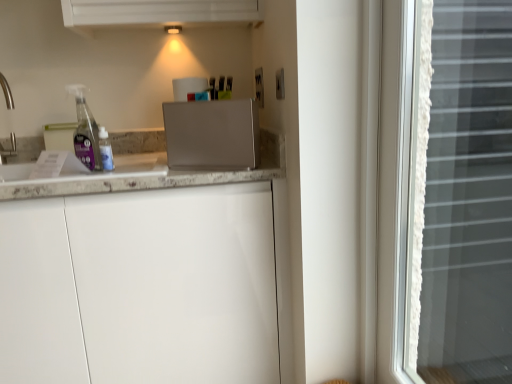
Question: From the image's perspective, is satin silver toaster at center above or below white matte cabinet at center?

Choices:
 (A) below
 (B) above

Answer: (B)

Question: In terms of size, does satin silver toaster at center appear bigger or smaller than white matte cabinet at center?

Choices:
 (A) big
 (B) small

Answer: (B)

Question: Estimate the real-world distances between objects in this image. Which object is closer to the white lace curtain at right?

Choices:
 (A) white matte cabinet at center
 (B) satin silver toaster at center
 (C) white marble countertop at left

Answer: (B)

Question: Estimate the real-world distances between objects in this image. Which object is closer to the white marble countertop at left?

Choices:
 (A) white lace curtain at right
 (B) satin silver toaster at center
 (C) white matte cabinet at center

Answer: (B)